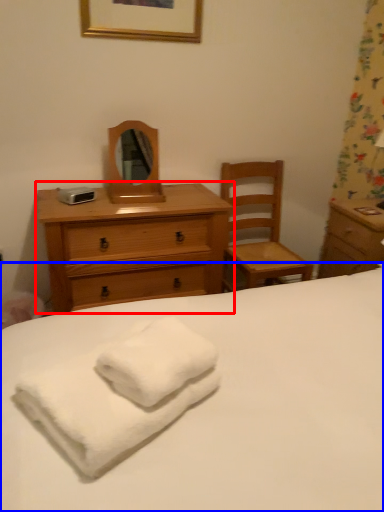
Question: Among these objects, which one is nearest to the camera, chest of drawers (highlighted by a red box) or bed (highlighted by a blue box)?

Choices:
 (A) chest of drawers
 (B) bed

Answer: (B)